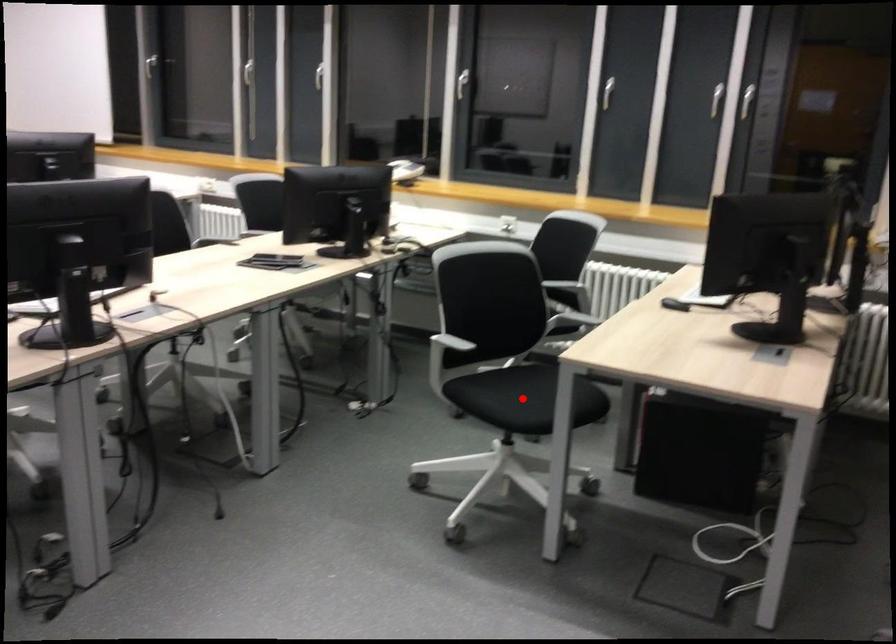
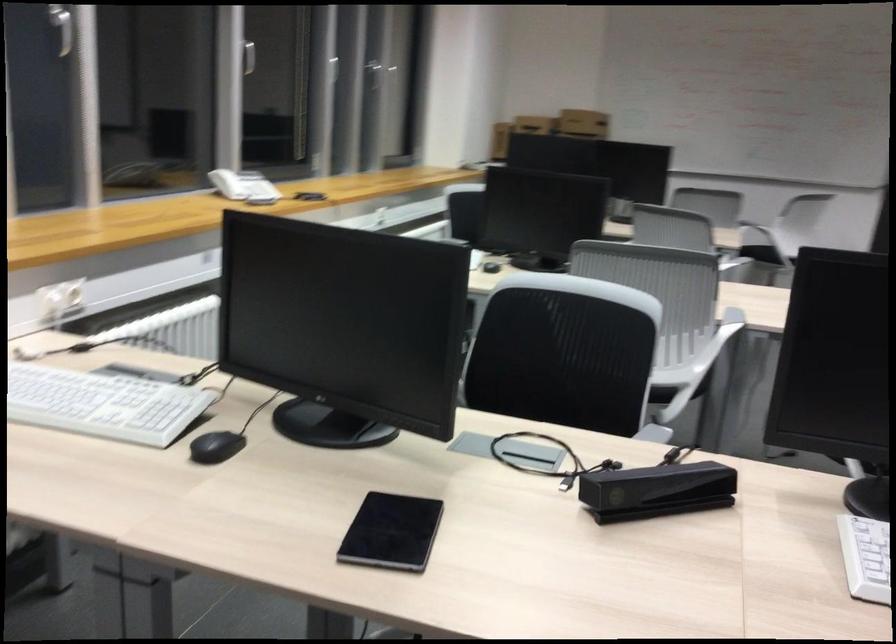
Question: I am providing you with two images of the same scene from different viewpoints. A red point is marked on the first image. At the location where the point appears in image 1, is it still visible in image 2?

Choices:
 (A) Yes
 (B) No

Answer: (B)